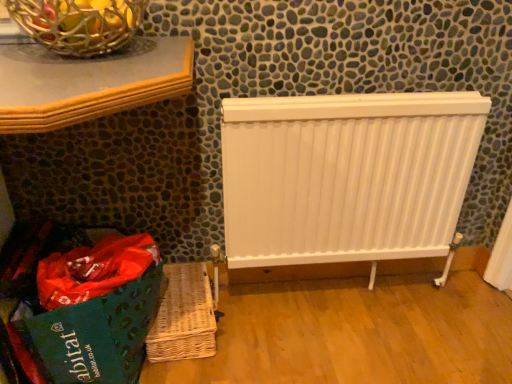
Question: In the image, is green fabric shopping bag at lower left positioned in front of or behind metallic wire basket at upper left?

Choices:
 (A) behind
 (B) front

Answer: (A)

Question: Based on their sizes in the image, would you say green fabric shopping bag at lower left is bigger or smaller than metallic wire basket at upper left?

Choices:
 (A) big
 (B) small

Answer: (A)

Question: Which is nearer to the metallic wire basket at upper left?

Choices:
 (A) woven brown basket at lower left
 (B) white matte radiator at center
 (C) green fabric shopping bag at lower left

Answer: (C)

Question: Which object is positioned closest to the metallic wire basket at upper left?

Choices:
 (A) woven brown basket at lower left
 (B) green fabric shopping bag at lower left
 (C) white matte radiator at center

Answer: (B)